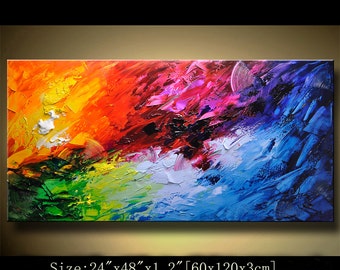
The width and height of the screenshot is (340, 270). Find the location of `wall background`. wall background is located at coordinates (258, 240).